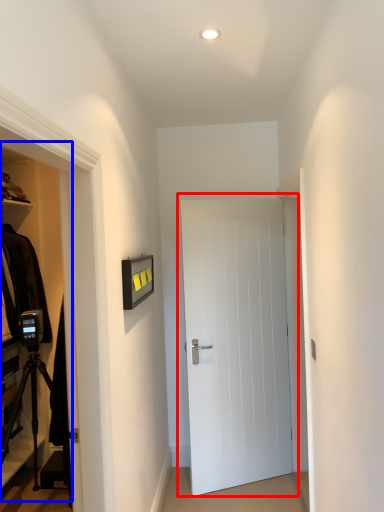
Question: Which point is further to the camera, door (highlighted by a red box) or dresser (highlighted by a blue box)?

Choices:
 (A) door
 (B) dresser

Answer: (A)